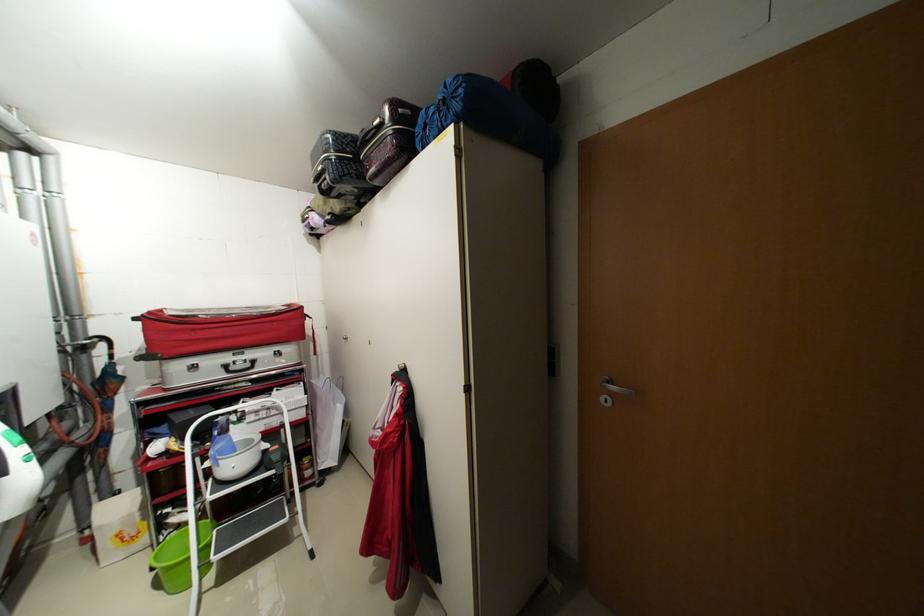
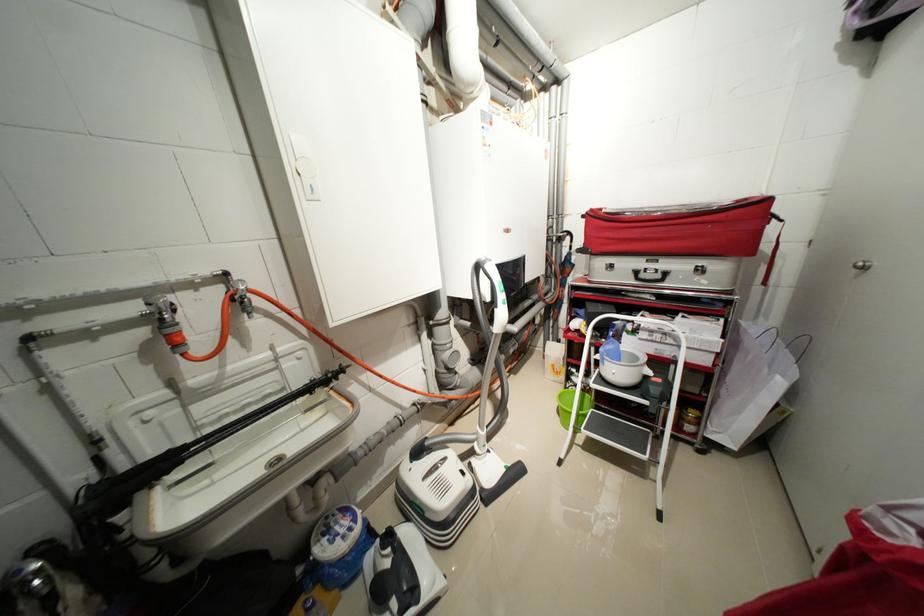
First-person continuous shooting, in which direction is the camera rotating?

The rotation direction of the camera is left-down.